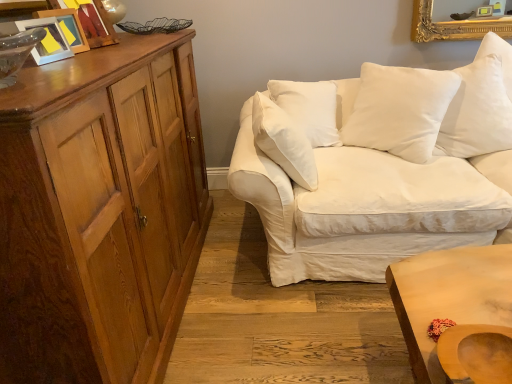
Question: From a real-world perspective, is white cotton couch at right above or below white cotton pillow at upper right, the 2th pillow viewed from the left?

Choices:
 (A) above
 (B) below

Answer: (B)

Question: Does point (397, 134) appear closer or farther from the camera than point (501, 86)?

Choices:
 (A) farther
 (B) closer

Answer: (A)

Question: Estimate the real-world distances between objects in this image. Which object is farther from the wooden picture frame at upper left, positioned as the second picture frame in back-to-front order?

Choices:
 (A) shiny brown cabinet at left
 (B) matte plastic picture frame at upper left, arranged as the first picture frame when viewed from the front
 (C) wooden picture frame at upper left, acting as the 3th picture frame starting from the front
 (D) wooden swivel chair at lower right
 (E) white cotton couch at right

Answer: (D)

Question: Which of these objects is positioned farthest from the wooden picture frame at upper left, acting as the 3th picture frame starting from the front?

Choices:
 (A) light brown wooden table at lower right
 (B) matte plastic picture frame at upper left, the 3th picture frame viewed from the back
 (C) wooden picture frame at upper left, positioned as the second picture frame in back-to-front order
 (D) white cotton pillow at upper right, placed as the 1th pillow when sorted from right to left
 (E) wooden swivel chair at lower right

Answer: (D)